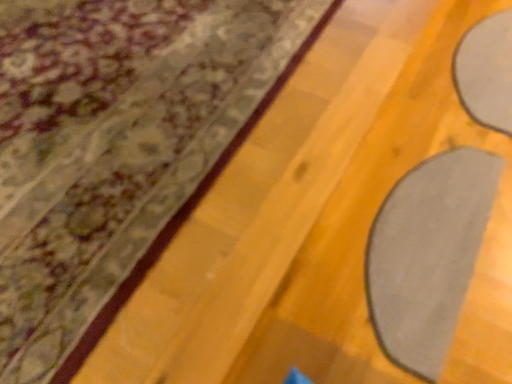
Image resolution: width=512 pixels, height=384 pixels. What are the coordinates of `gray matte yoga mat at lower right` in the screenshot? It's located at (428, 255).

Describe the element at coordinates (428, 255) in the screenshot. I see `gray matte yoga mat at lower right` at that location.

Measure the distance between matte gray curtain at upper right and camera.

matte gray curtain at upper right and camera are 30.34 inches apart from each other.

This screenshot has height=384, width=512. What do you see at coordinates (114, 144) in the screenshot?
I see `matte gray curtain at upper right` at bounding box center [114, 144].

The image size is (512, 384). I want to click on matte gray curtain at upper right, so click(x=114, y=144).

At what (x,y) coordinates should I click in order to perform the action: click on gray matte yoga mat at lower right. Please return your answer as a coordinate pair (x, y). The image size is (512, 384). Looking at the image, I should click on (428, 255).

Based on the photo, is gray matte yoga mat at lower right at the right side of matte gray curtain at upper right?

Indeed, gray matte yoga mat at lower right is positioned on the right side of matte gray curtain at upper right.

Based on the photo, who is more distant, gray matte yoga mat at lower right or matte gray curtain at upper right?

gray matte yoga mat at lower right is further from the camera.

Is point (438, 272) farther from viewer compared to point (284, 34)?

No.

From the image's perspective, which is below, gray matte yoga mat at lower right or matte gray curtain at upper right?

gray matte yoga mat at lower right.

From a real-world perspective, which is physically above, gray matte yoga mat at lower right or matte gray curtain at upper right?

From a 3D spatial view, matte gray curtain at upper right is above.

Which of these two, gray matte yoga mat at lower right or matte gray curtain at upper right, is wider?

With larger width is matte gray curtain at upper right.

From the picture: In terms of height, does gray matte yoga mat at lower right look taller or shorter compared to matte gray curtain at upper right?

gray matte yoga mat at lower right is taller than matte gray curtain at upper right.

Between gray matte yoga mat at lower right and matte gray curtain at upper right, which one has larger size?

Bigger between the two is matte gray curtain at upper right.

Can matte gray curtain at upper right be found inside gray matte yoga mat at lower right?

No, gray matte yoga mat at lower right does not contain matte gray curtain at upper right.

Is gray matte yoga mat at lower right directly adjacent to matte gray curtain at upper right?

gray matte yoga mat at lower right and matte gray curtain at upper right are clearly separated.

Is gray matte yoga mat at lower right looking in the opposite direction of matte gray curtain at upper right?

No.

How many degrees apart are the facing directions of gray matte yoga mat at lower right and matte gray curtain at upper right?

1.19 degrees separate the facing orientations of gray matte yoga mat at lower right and matte gray curtain at upper right.

Locate an element on the screen. curtain located above the gray matte yoga mat at lower right (from a real-world perspective) is located at coordinates (114, 144).

Between matte gray curtain at upper right and gray matte yoga mat at lower right, which one appears on the right side from the viewer's perspective?

gray matte yoga mat at lower right is more to the right.

Is matte gray curtain at upper right positioned in front of gray matte yoga mat at lower right?

That is True.

Considering the points (289, 29) and (419, 353), which point is in front, point (289, 29) or point (419, 353)?

The point (419, 353) is closer to the camera.

From the image's perspective, which one is positioned lower, matte gray curtain at upper right or gray matte yoga mat at lower right?

From the image's view, gray matte yoga mat at lower right is below.

From a real-world perspective, between matte gray curtain at upper right and gray matte yoga mat at lower right, who is vertically higher?

From a 3D spatial view, matte gray curtain at upper right is above.

Is matte gray curtain at upper right wider or thinner than gray matte yoga mat at lower right?

In the image, matte gray curtain at upper right appears to be wider than gray matte yoga mat at lower right.

Considering the sizes of objects matte gray curtain at upper right and gray matte yoga mat at lower right in the image provided, who is shorter, matte gray curtain at upper right or gray matte yoga mat at lower right?

With less height is matte gray curtain at upper right.

Considering the sizes of matte gray curtain at upper right and gray matte yoga mat at lower right in the image, is matte gray curtain at upper right bigger or smaller than gray matte yoga mat at lower right?

Considering their sizes, matte gray curtain at upper right takes up more space than gray matte yoga mat at lower right.

Would you say matte gray curtain at upper right is outside gray matte yoga mat at lower right?

matte gray curtain at upper right is positioned outside gray matte yoga mat at lower right.

Is matte gray curtain at upper right positioned far away from gray matte yoga mat at lower right?

They are positioned close to each other.

Is matte gray curtain at upper right aimed at gray matte yoga mat at lower right?

No.

How many degrees apart are the facing directions of matte gray curtain at upper right and gray matte yoga mat at lower right?

matte gray curtain at upper right and gray matte yoga mat at lower right are facing 1.19 degrees away from each other.

Where is `curtain lying on the left of gray matte yoga mat at lower right`? curtain lying on the left of gray matte yoga mat at lower right is located at coordinates (114, 144).

Identify the location of yoga mat that appears on the right of matte gray curtain at upper right. The image size is (512, 384). (428, 255).

What are the coordinates of `curtain located above the gray matte yoga mat at lower right (from a real-world perspective)` in the screenshot? It's located at (114, 144).